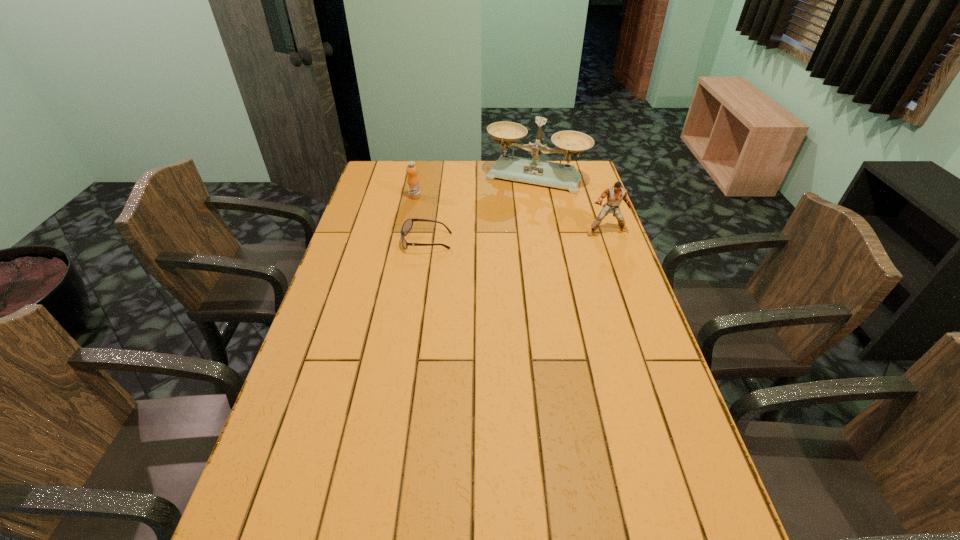
The height and width of the screenshot is (540, 960). I want to click on sunglasses, so click(407, 225).

Locate an element on the screen. This screenshot has height=540, width=960. the third shortest object is located at coordinates (615, 195).

I want to click on scale, so click(534, 171).

The height and width of the screenshot is (540, 960). I want to click on the second shortest object, so click(413, 183).

Locate an element on the screen. This screenshot has height=540, width=960. vacant space located 0.080m on the lenses of the shortest object is located at coordinates (379, 241).

Locate an element on the screen. vacant region located on the lenses of the shortest object is located at coordinates (368, 241).

Identify the location of free spot located 0.060m on the lenses of the shortest object. The height and width of the screenshot is (540, 960). (385, 241).

Where is `free space located on the front-facing side of the puncher`? This screenshot has width=960, height=540. free space located on the front-facing side of the puncher is located at coordinates [x=631, y=299].

The height and width of the screenshot is (540, 960). Identify the location of free region located on the front-facing side of the scale. (495, 245).

Find the location of a particular element. The image size is (960, 540). vacant space situated 0.370m on the front-facing side of the scale is located at coordinates (493, 248).